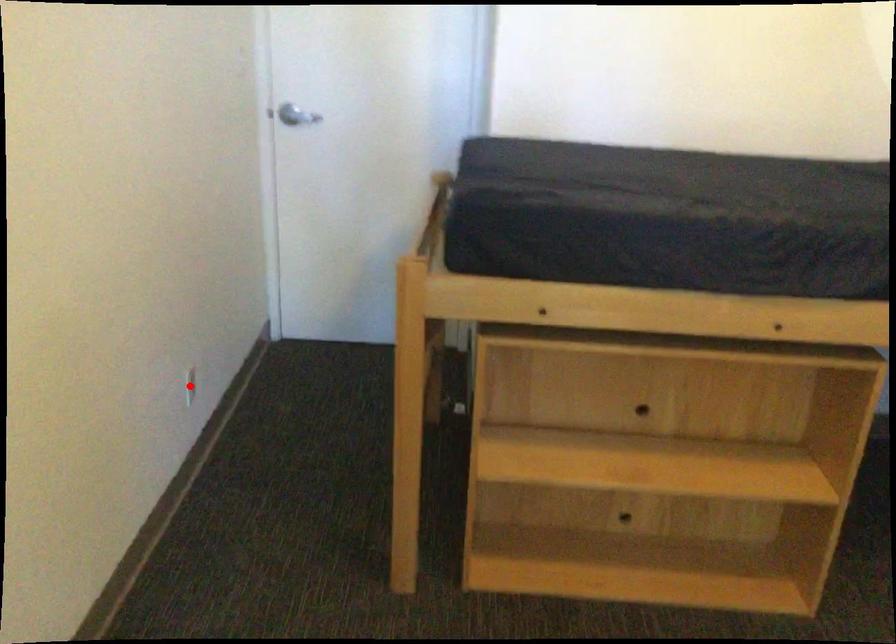
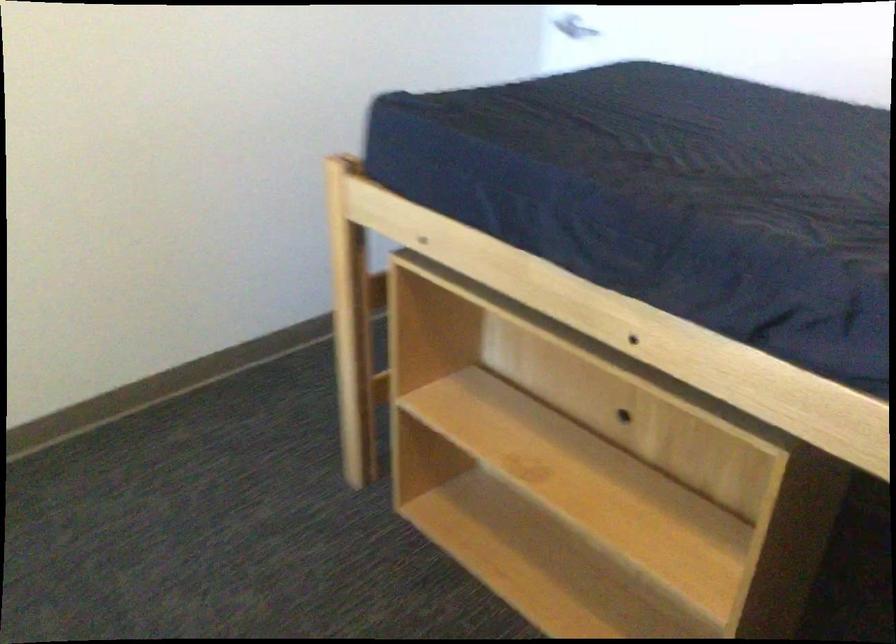
Question: I am providing you with two images of the same scene from different viewpoints. A red point is marked on the first image. At the location where the point appears in image 1, is it still visible in image 2?

Choices:
 (A) Yes
 (B) No

Answer: (B)